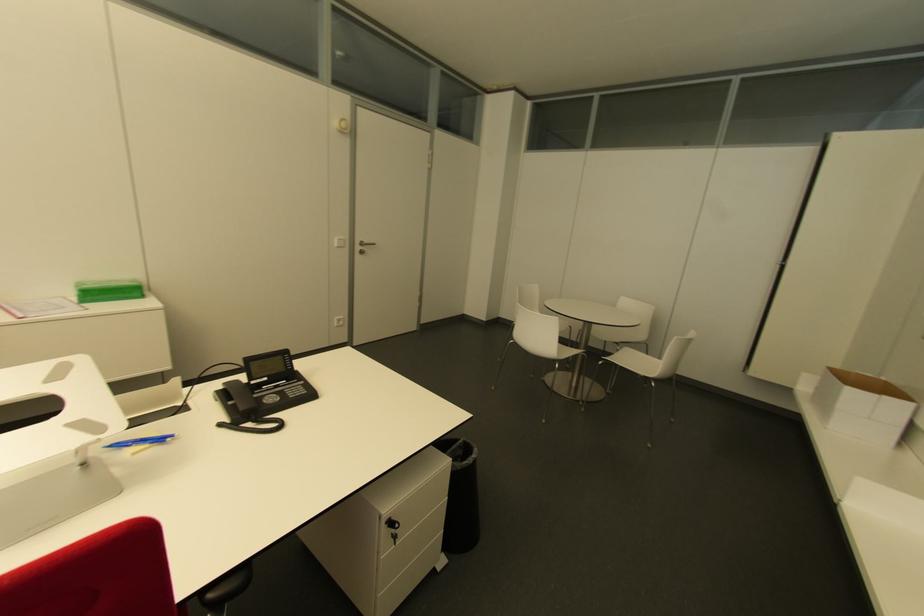
Where is `white light switch`? This screenshot has height=616, width=924. white light switch is located at coordinates (339, 241).